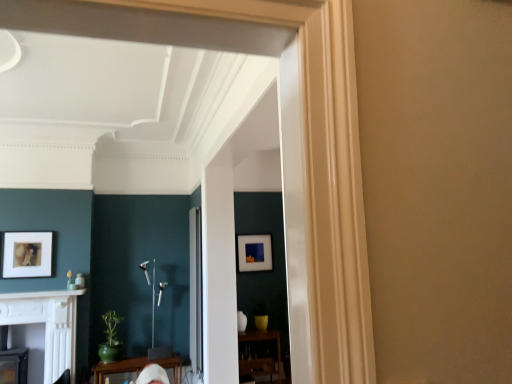
Question: From the image's perspective, would you say matte black picture frame at center, which appears as the second picture frame when viewed from the front, is shown under white glossy fireplace at lower left?

Choices:
 (A) yes
 (B) no

Answer: (B)

Question: From a real-world perspective, is matte black picture frame at center, the first picture frame from the back, on white glossy fireplace at lower left?

Choices:
 (A) no
 (B) yes

Answer: (B)

Question: From the image's perspective, would you say matte black picture frame at center, the 2th picture frame positioned from the left, is positioned over white glossy fireplace at lower left?

Choices:
 (A) yes
 (B) no

Answer: (A)

Question: From a real-world perspective, is matte black picture frame at center, the first picture frame from the back, below white glossy fireplace at lower left?

Choices:
 (A) no
 (B) yes

Answer: (A)

Question: Is matte black picture frame at center, which appears as the second picture frame when viewed from the front, located outside white glossy fireplace at lower left?

Choices:
 (A) yes
 (B) no

Answer: (A)

Question: Considering the positions of matte white picture frame at left, the second picture frame when ordered from right to left, and white glossy fireplace at lower left in the image, is matte white picture frame at left, the second picture frame when ordered from right to left, bigger or smaller than white glossy fireplace at lower left?

Choices:
 (A) big
 (B) small

Answer: (B)

Question: In terms of height, does matte white picture frame at left, which is counted as the 1th picture frame, starting from the left, look taller or shorter compared to white glossy fireplace at lower left?

Choices:
 (A) tall
 (B) short

Answer: (B)

Question: Choose the correct answer: Is matte white picture frame at left, the second picture frame when ordered from right to left, inside white glossy fireplace at lower left or outside it?

Choices:
 (A) outside
 (B) inside

Answer: (A)

Question: From a real-world perspective, is matte white picture frame at left, the second picture frame when ordered from right to left, physically located above or below white glossy fireplace at lower left?

Choices:
 (A) above
 (B) below

Answer: (A)

Question: In terms of width, does white marble fireplace at lower left look wider or thinner when compared to white glossy fireplace at lower left?

Choices:
 (A) thin
 (B) wide

Answer: (A)

Question: Looking at the image, does white marble fireplace at lower left seem bigger or smaller compared to white glossy fireplace at lower left?

Choices:
 (A) big
 (B) small

Answer: (B)

Question: Considering the positions of white marble fireplace at lower left and white glossy fireplace at lower left in the image, is white marble fireplace at lower left taller or shorter than white glossy fireplace at lower left?

Choices:
 (A) tall
 (B) short

Answer: (B)

Question: Would you say white marble fireplace at lower left is inside or outside white glossy fireplace at lower left?

Choices:
 (A) inside
 (B) outside

Answer: (B)

Question: Is point (201, 256) closer or farther from the camera than point (64, 294)?

Choices:
 (A) closer
 (B) farther

Answer: (A)

Question: Looking at their shapes, would you say clear glass door at center is wider or thinner than white marble fireplace at lower left?

Choices:
 (A) thin
 (B) wide

Answer: (A)